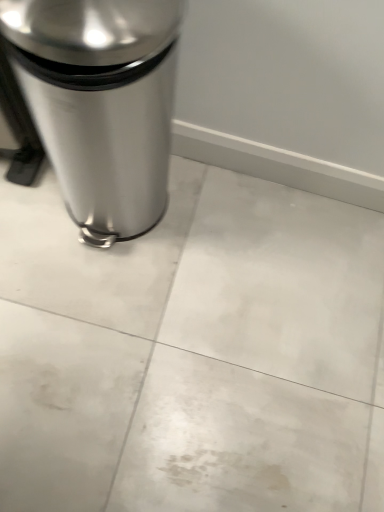
Identify the location of polished stainless steel trash can at left. (101, 103).

Image resolution: width=384 pixels, height=512 pixels. What do you see at coordinates (101, 103) in the screenshot? I see `polished stainless steel trash can at left` at bounding box center [101, 103].

Identify the location of polished stainless steel trash can at left. Image resolution: width=384 pixels, height=512 pixels. (101, 103).